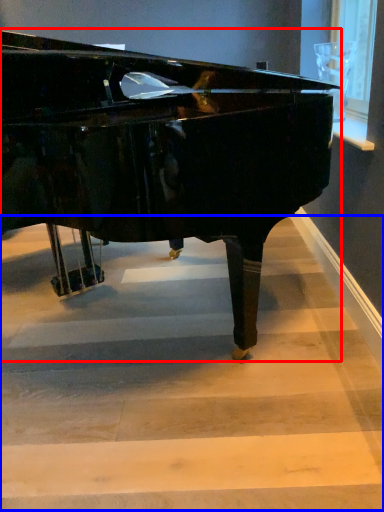
Question: Which point is closer to the camera, piano (highlighted by a red box) or stairwell (highlighted by a blue box)?

Choices:
 (A) piano
 (B) stairwell

Answer: (A)